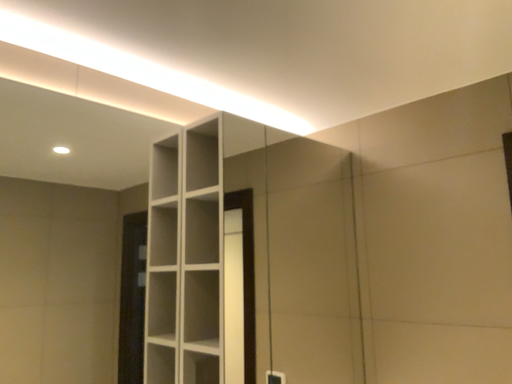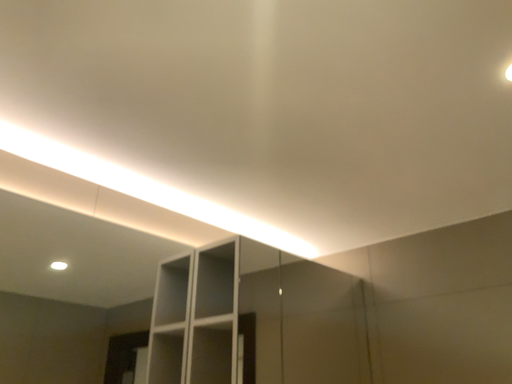
Question: Which way did the camera rotate in the video?

Choices:
 (A) rotated downward
 (B) rotated upward

Answer: (B)